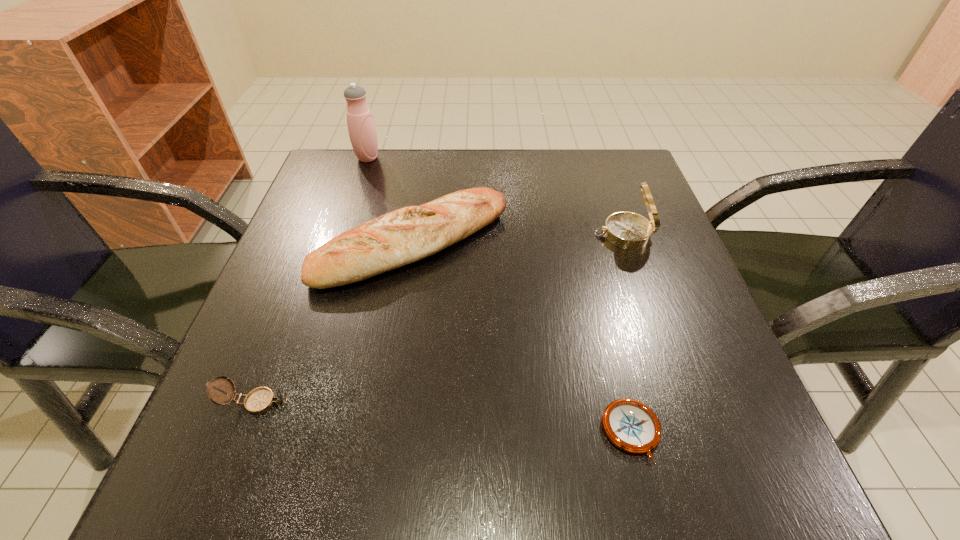
Locate an element on the screen. compass at the left edge is located at coordinates (260, 400).

I want to click on thermos bottle at the far left corner, so click(x=362, y=132).

I want to click on baguet that is at the far left corner, so click(395, 239).

The image size is (960, 540). What are the coordinates of `object that is positioned at the near right corner` in the screenshot? It's located at (632, 426).

Where is `blank area at the far edge`? blank area at the far edge is located at coordinates (536, 186).

The width and height of the screenshot is (960, 540). In the image, there is a desktop. Identify the location of vacant space at the near edge. (517, 437).

Locate an element on the screen. free space at the left edge is located at coordinates (291, 288).

Image resolution: width=960 pixels, height=540 pixels. Find the location of `vacant region at the right edge`. vacant region at the right edge is located at coordinates (602, 215).

Locate an element on the screen. This screenshot has width=960, height=540. free location at the far left corner is located at coordinates (387, 159).

You are a GUI agent. You are given a task and a screenshot of the screen. Output one action in this format:
    pyautogui.click(x=<x>, y=<y>)
    Task: Click on the free space at the near left corner of the desktop
    This screenshot has width=960, height=540.
    Given the screenshot: What is the action you would take?
    pyautogui.click(x=269, y=444)